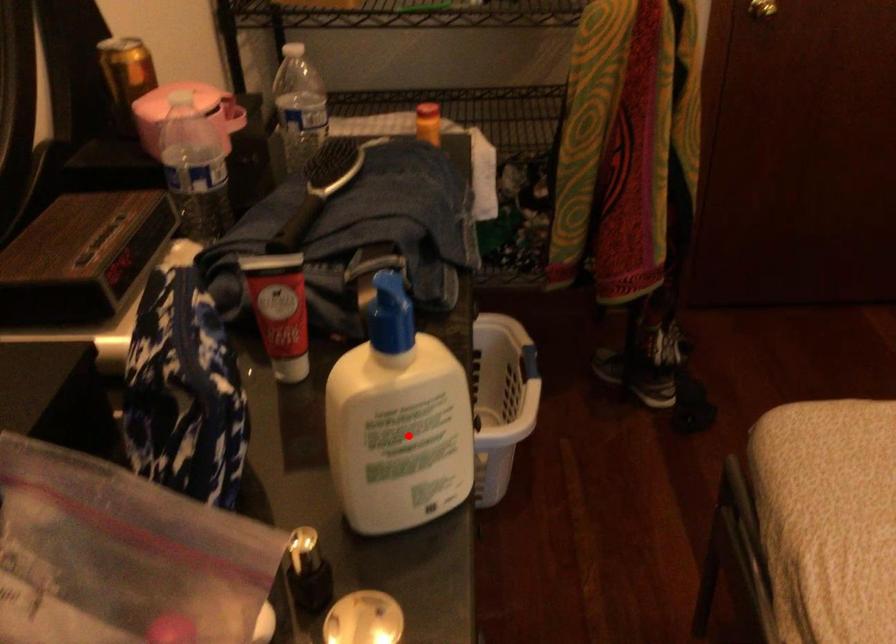
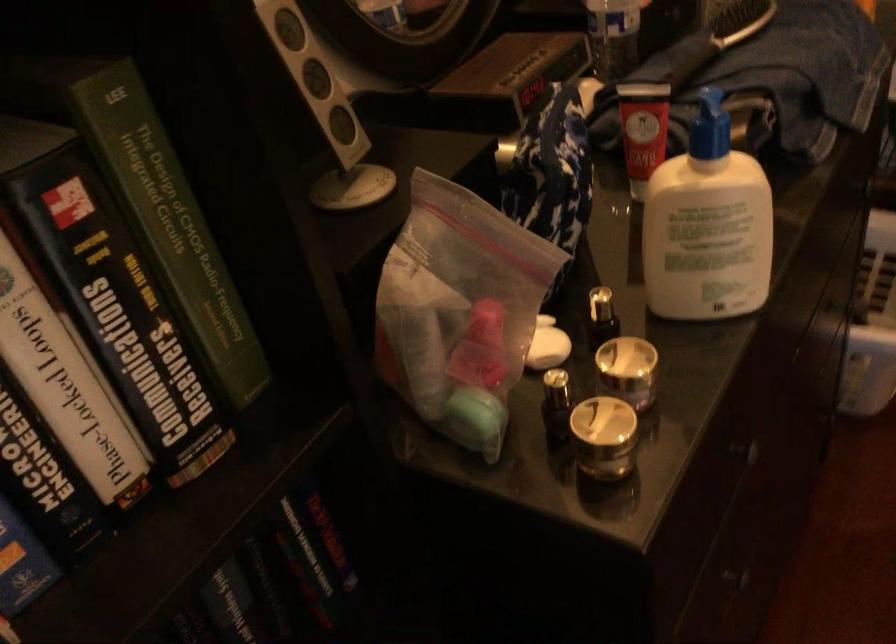
The point at the highlighted location is marked in the first image. Where is the corresponding point in the second image?

(707, 225)